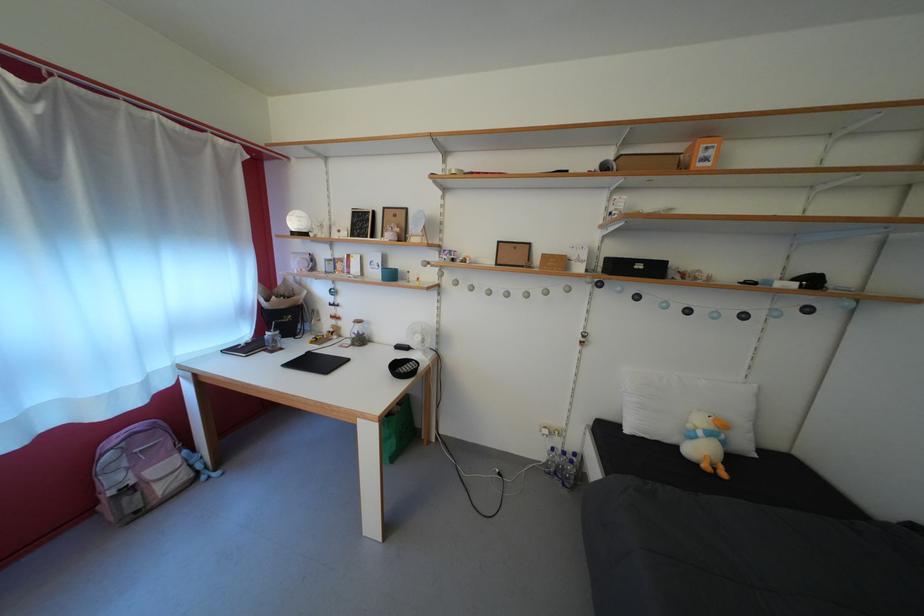
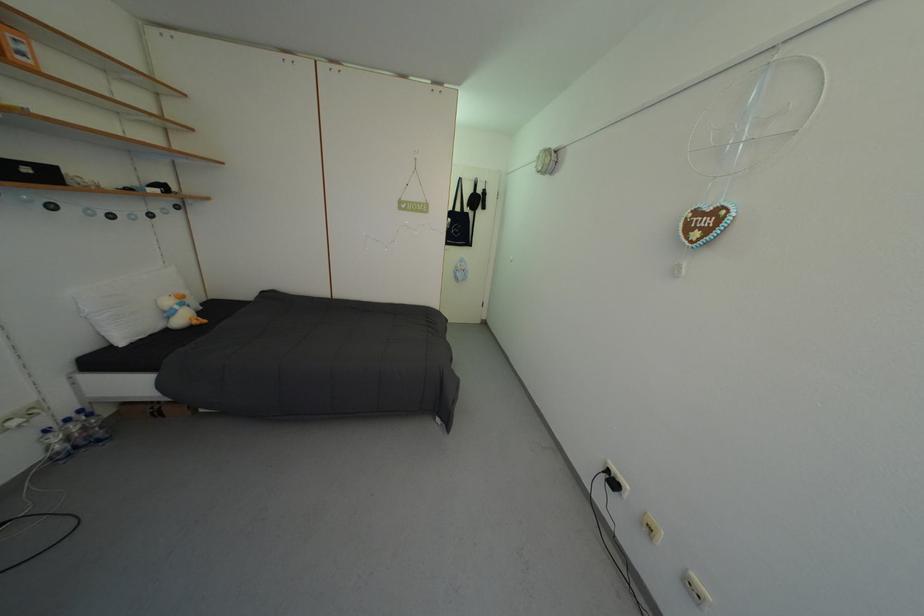
Find the pixel in the second image that matches (x=714, y=166) in the first image.

(30, 60)